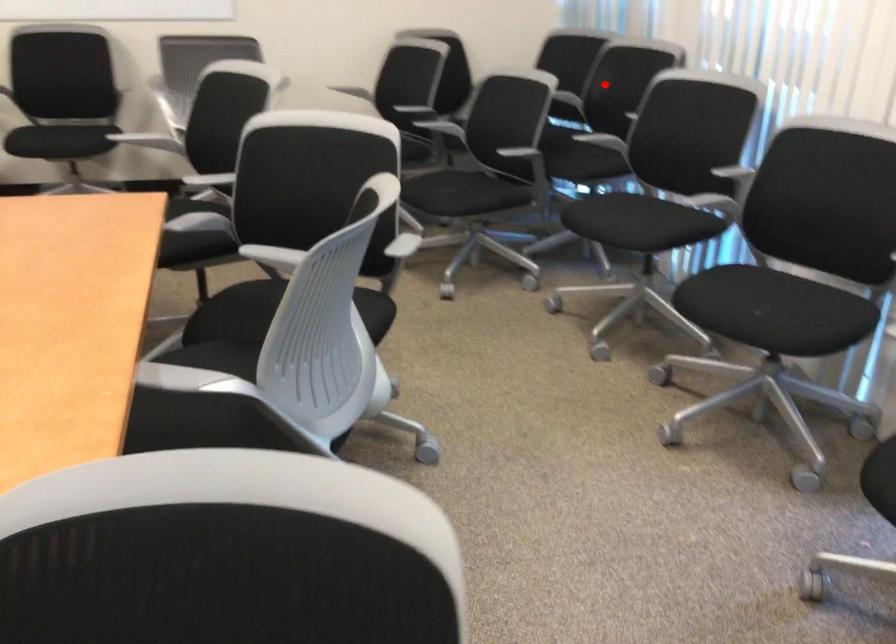
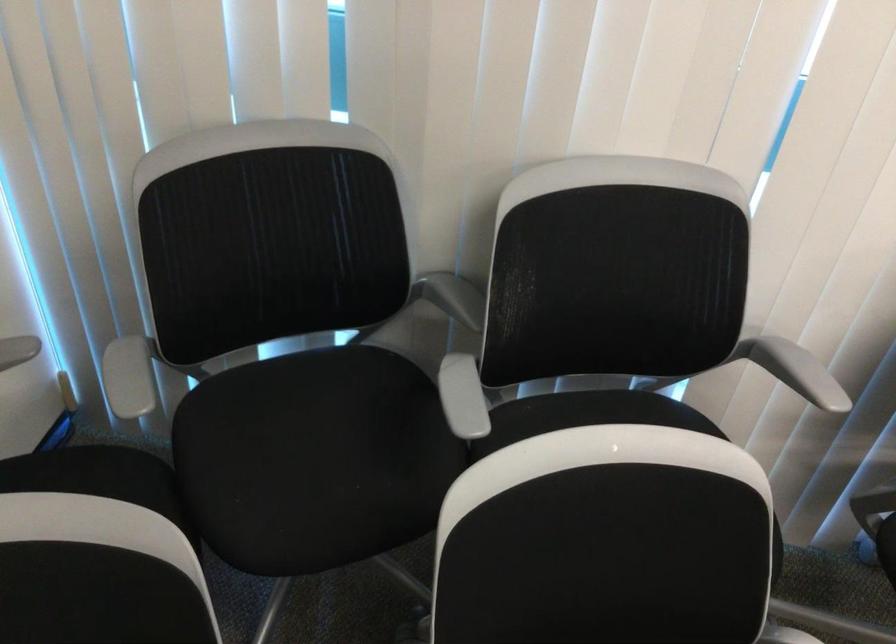
In the second image, find the point that corresponds to the highlighted location in the first image.

(453, 297)